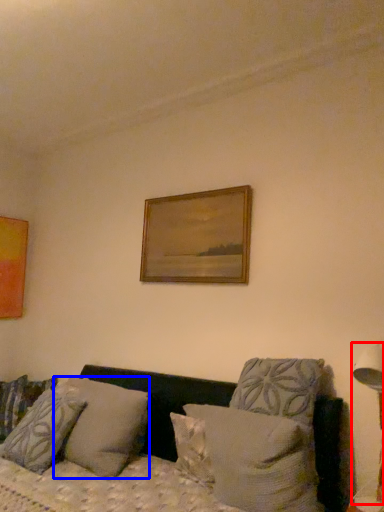
Question: Which object is further to the camera taking this photo, table lamp (highlighted by a red box) or pillow (highlighted by a blue box)?

Choices:
 (A) table lamp
 (B) pillow

Answer: (B)